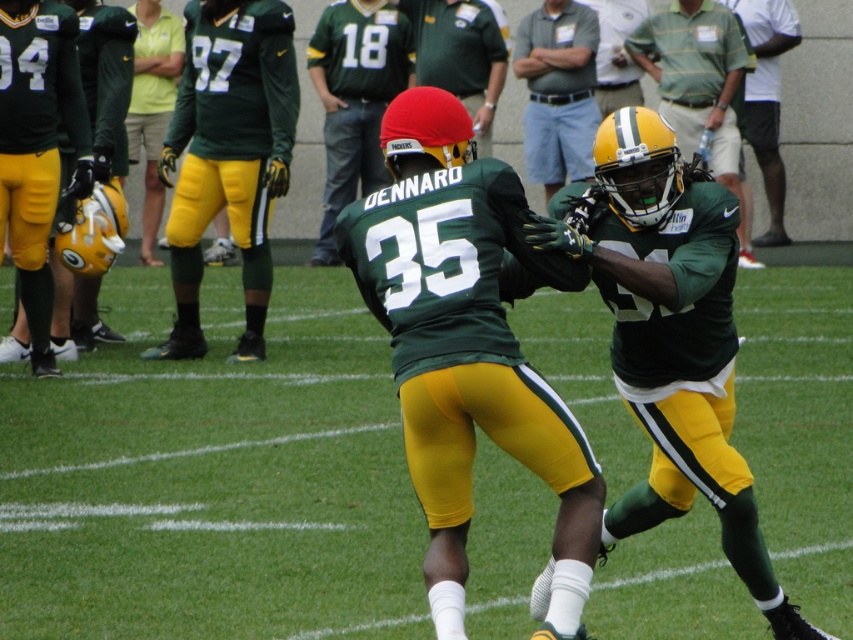
Who is taller, green/yellow turf at center or matte green helmet at upper right?

matte green helmet at upper right is taller.

Is point (140, 460) more distant than point (695, 132)?

No, (140, 460) is in front of (695, 132).

Where is `green/yellow turf at center`? green/yellow turf at center is located at coordinates (212, 480).

Can you confirm if matte green helmet at left is shorter than green jersey at upper right?

Incorrect, matte green helmet at left's height does not fall short of green jersey at upper right's.

Does matte green helmet at left have a smaller size compared to green jersey at upper right?

Yes, matte green helmet at left is smaller than green jersey at upper right.

Where is `matte green helmet at left`? This screenshot has width=853, height=640. matte green helmet at left is located at coordinates point(38,147).

The image size is (853, 640). What are the coordinates of `matte green helmet at left` in the screenshot? It's located at (38, 147).

Between point (332, 200) and point (554, 92), which one is positioned behind?

Point (332, 200)

Is green matte jersey at center taller than light blue cotton shirt at center?

Yes, green matte jersey at center is taller than light blue cotton shirt at center.

Does point (346, 97) come closer to viewer compared to point (572, 84)?

Yes.

This screenshot has height=640, width=853. What are the coordinates of `green matte jersey at center` in the screenshot? It's located at (355, 99).